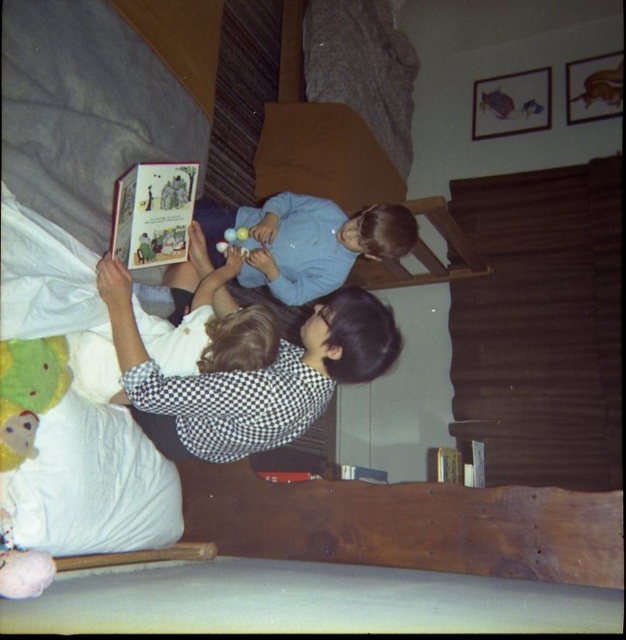
Can you confirm if hardcover book at center is positioned to the left of green plush mouse at lower left?

No, hardcover book at center is not to the left of green plush mouse at lower left.

Measure the distance from hardcover book at center to green plush mouse at lower left.

hardcover book at center is 17.95 inches away from green plush mouse at lower left.

Is point (180, 243) positioned behind point (23, 433)?

That is True.

Where is `hardcover book at center`? This screenshot has width=626, height=640. hardcover book at center is located at coordinates (153, 212).

Is point (367, 257) closer to viewer compared to point (141, 220)?

No, it is behind (141, 220).

Between light blue fabric at center and hardcover book at center, which one is positioned higher?

Positioned higher is hardcover book at center.

Locate an element on the screen. The image size is (626, 640). light blue fabric at center is located at coordinates (305, 241).

Does point (334, 314) come farther from viewer compared to point (163, 248)?

That is False.

Does checkered fabric shirt at center have a lesser width compared to hardcover book at center?

Incorrect, checkered fabric shirt at center's width is not less than hardcover book at center's.

Does point (150, 397) come in front of point (178, 179)?

Yes.

Image resolution: width=626 pixels, height=640 pixels. Find the location of `checkered fabric shirt at center`. checkered fabric shirt at center is located at coordinates (254, 372).